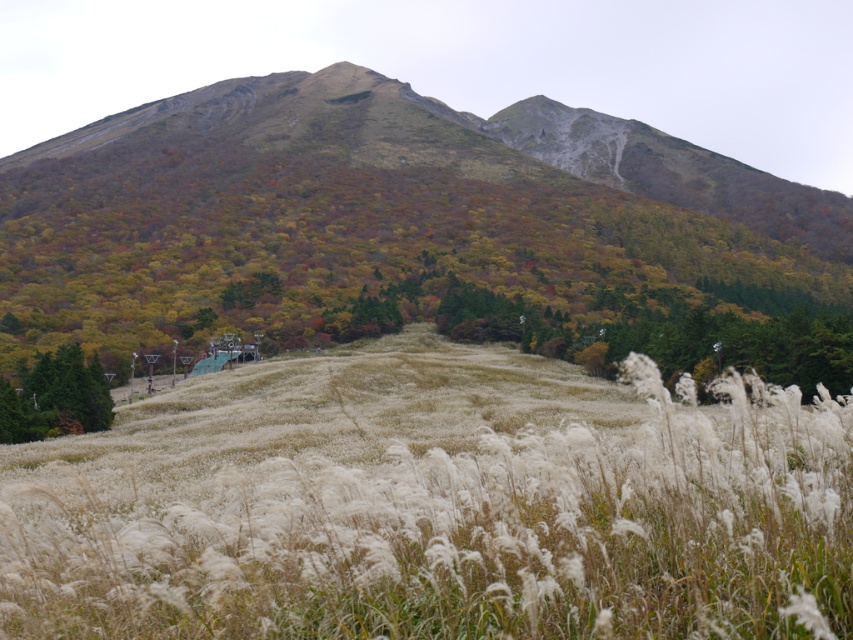
Question: Does white fluffy grass at center come in front of multicolored foliage at upper center?

Choices:
 (A) no
 (B) yes

Answer: (B)

Question: Which object is the closest to the white fluffy grass at center?

Choices:
 (A) green matte tree at lower left
 (B) multicolored foliage at upper center

Answer: (A)

Question: Observing the image, what is the correct spatial positioning of white fluffy grass at center in reference to green matte tree at lower left?

Choices:
 (A) above
 (B) below

Answer: (A)

Question: Which of the following is the closest to the observer?

Choices:
 (A) multicolored foliage at upper center
 (B) white fluffy grass at center

Answer: (B)

Question: Estimate the real-world distances between objects in this image. Which object is farther from the multicolored foliage at upper center?

Choices:
 (A) green matte tree at lower left
 (B) white fluffy grass at center

Answer: (A)

Question: Is multicolored foliage at upper center wider than green matte tree at lower left?

Choices:
 (A) yes
 (B) no

Answer: (A)